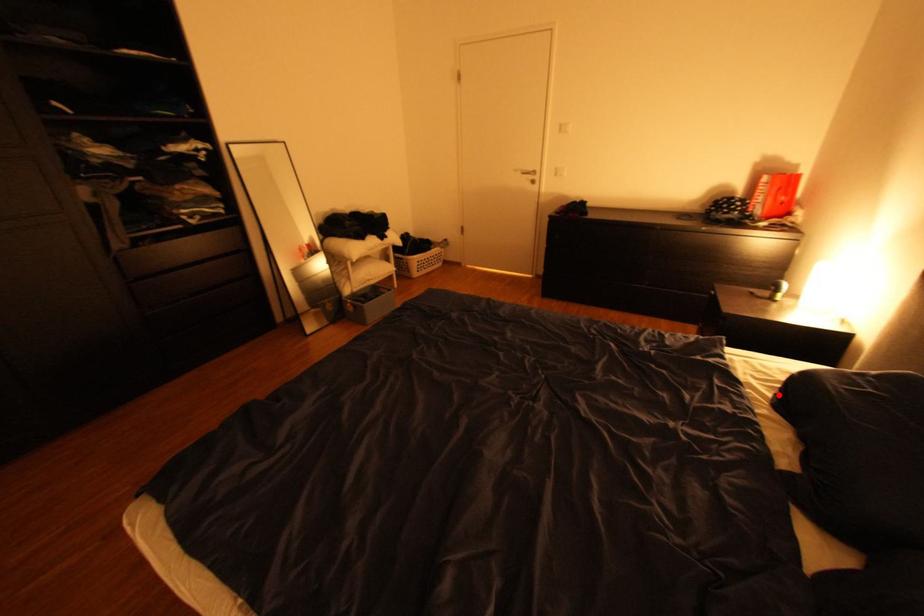
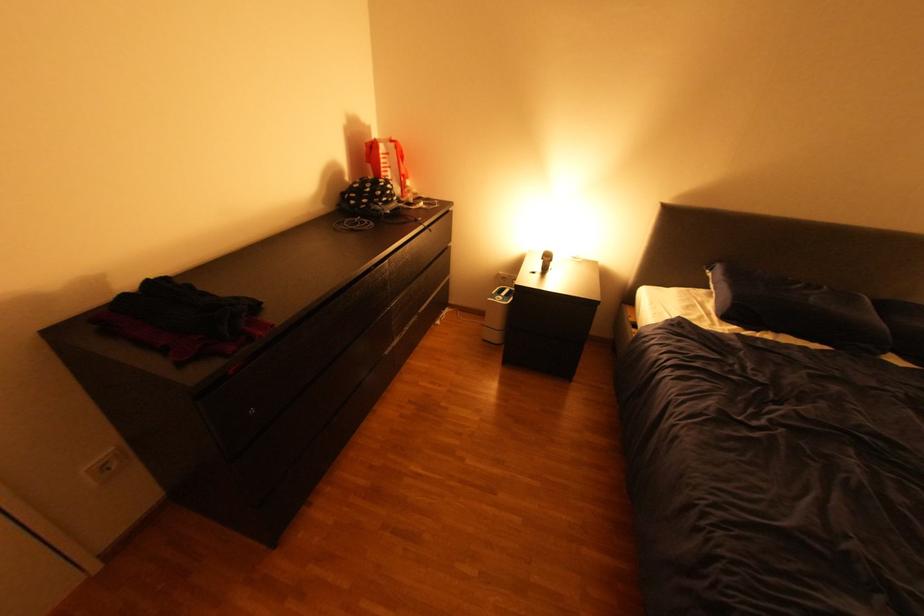
Find the pixel in the second image that matches the highlighted location in the first image.

(745, 326)